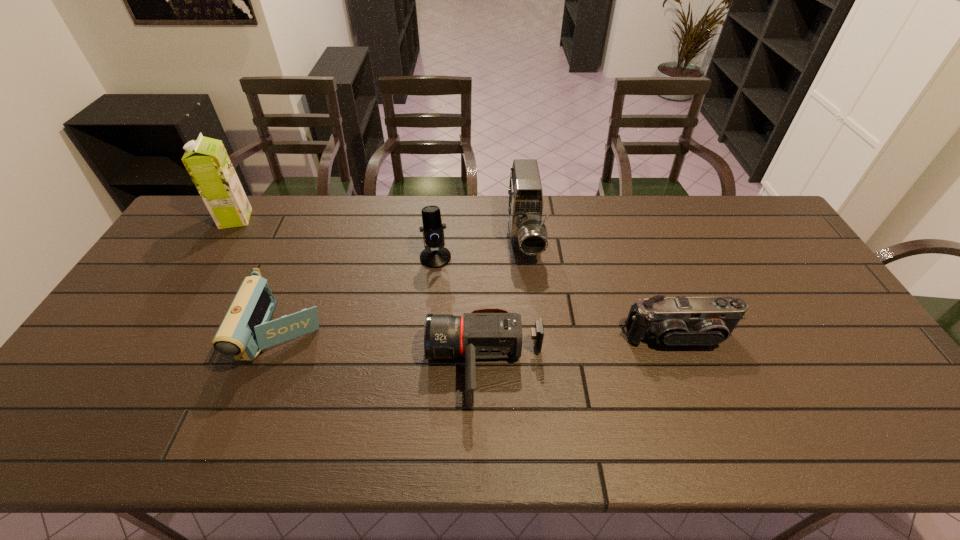
Image resolution: width=960 pixels, height=540 pixels. I want to click on blank space at the far edge, so (x=448, y=198).

You are a GUI agent. You are given a task and a screenshot of the screen. Output one action in this format:
    pyautogui.click(x=<x>, y=<y>)
    Task: Click on the vacant space at the near edge of the desktop
    
    Given the screenshot: What is the action you would take?
    pyautogui.click(x=290, y=423)

The width and height of the screenshot is (960, 540). I want to click on vacant space at the left edge of the desktop, so click(x=175, y=259).

Identify the location of vacant space at the right edge. This screenshot has height=540, width=960. (870, 355).

The width and height of the screenshot is (960, 540). Identify the location of vacant space at the far left corner of the desktop. (204, 232).

What are the coordinates of `free space at the near left corner of the desktop` in the screenshot? It's located at (53, 427).

In the image, there is a desktop. What are the coordinates of `free space at the far right corner` in the screenshot? It's located at click(x=753, y=217).

Where is `free point between the third tallest object and the leftmost camcorder`? The height and width of the screenshot is (540, 960). free point between the third tallest object and the leftmost camcorder is located at coordinates (360, 296).

The image size is (960, 540). What are the coordinates of `free space between the leftmost camcorder and the microphone` in the screenshot? It's located at tap(360, 296).

Where is `unoccupied area between the rightmost camcorder and the farthest camcorder`? unoccupied area between the rightmost camcorder and the farthest camcorder is located at coordinates coord(601,288).